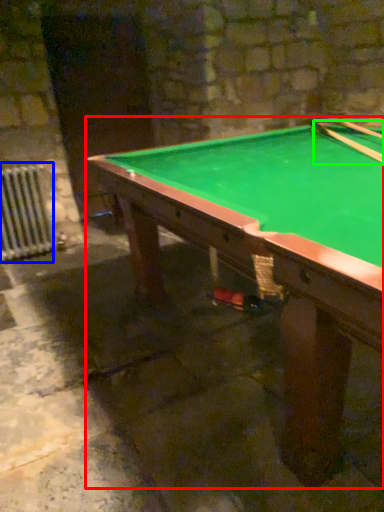
Question: Considering the real-world distances, which object is closest to billiard table (highlighted by a red box)? radiator (highlighted by a blue box) or cue (highlighted by a green box).

Choices:
 (A) radiator
 (B) cue

Answer: (B)